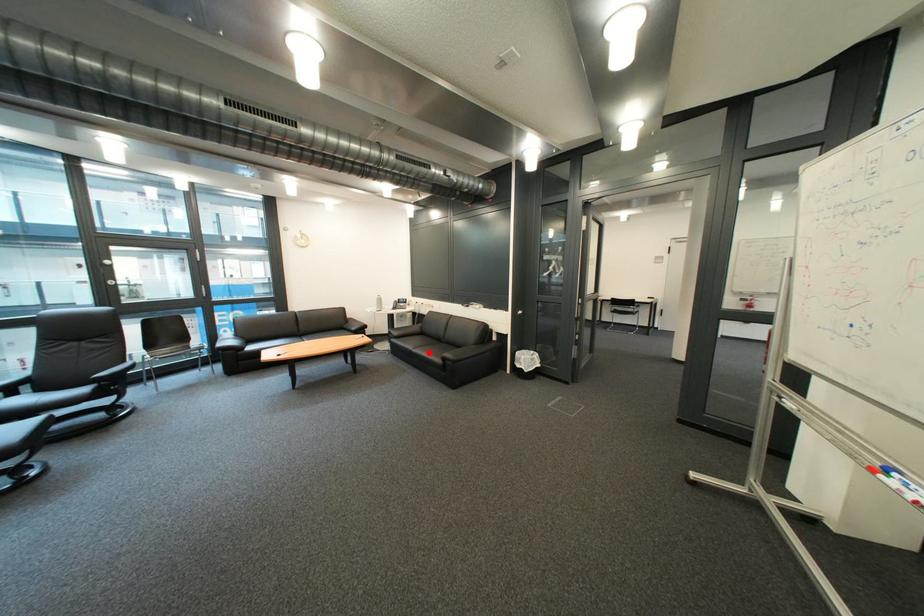
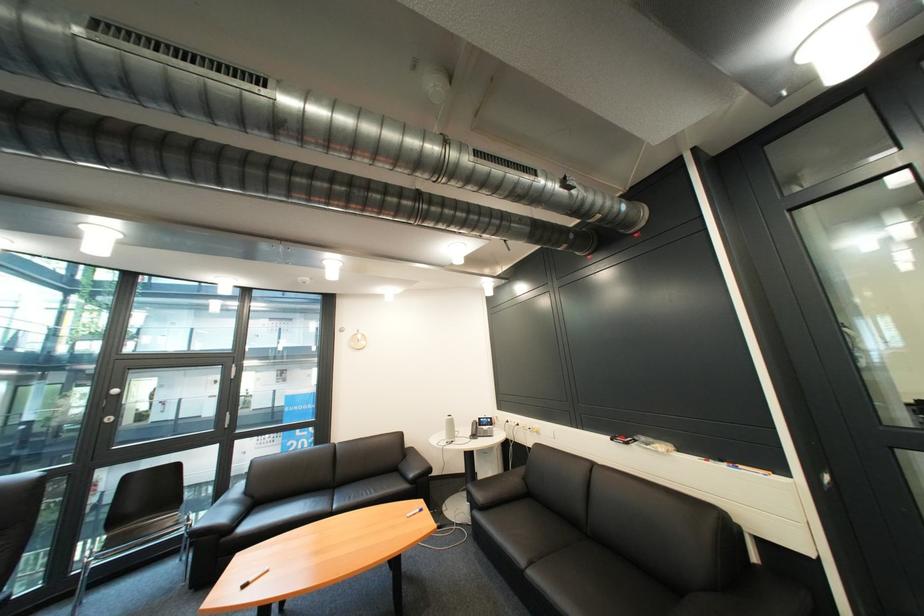
In the second image, find the point that corresponds to the highlighted location in the first image.

(546, 577)